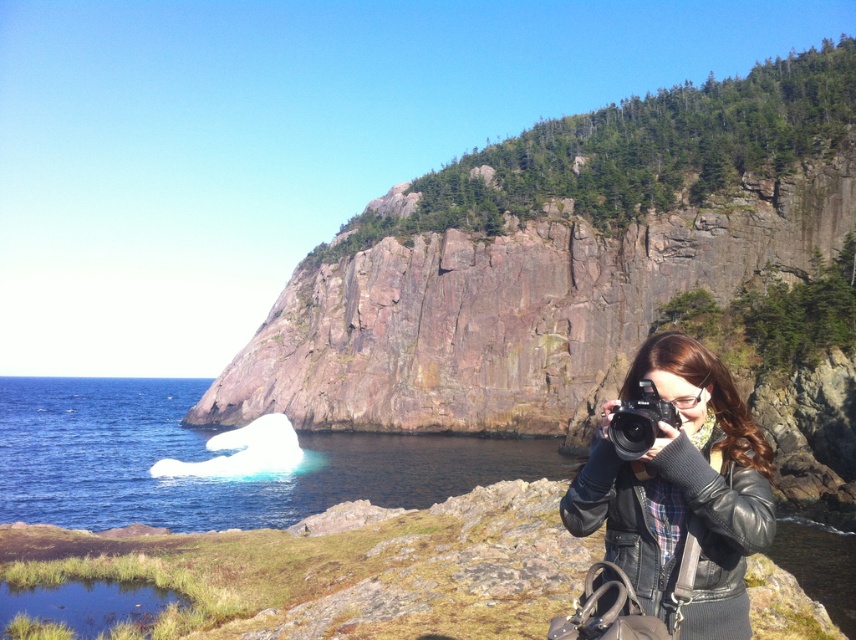
Does brown rock cliff at center appear over black plastic camera at lower right?

Yes.

Identify the location of brown rock cliff at center. This screenshot has height=640, width=856. [551, 257].

Describe the element at coordinates (551, 257) in the screenshot. I see `brown rock cliff at center` at that location.

Where is `brown rock cliff at center`? Image resolution: width=856 pixels, height=640 pixels. brown rock cliff at center is located at coordinates (551, 257).

Who is shorter, white ice at lower left or black leather jacket at lower right?

black leather jacket at lower right

Is white ice at lower left behind black leather jacket at lower right?

Yes, white ice at lower left is behind black leather jacket at lower right.

Describe the element at coordinates (214, 458) in the screenshot. I see `white ice at lower left` at that location.

Identify the location of white ice at lower left. The height and width of the screenshot is (640, 856). (214, 458).

Between brown rock cliff at center and black leather jacket at lower right, which one has less height?

With less height is black leather jacket at lower right.

The image size is (856, 640). Describe the element at coordinates (551, 257) in the screenshot. I see `brown rock cliff at center` at that location.

Who is more distant from viewer, (423, 404) or (745, 547)?

Point (423, 404)

At what (x,y) coordinates should I click in order to perform the action: click on brown rock cliff at center. Please return your answer as a coordinate pair (x, y). Looking at the image, I should click on (551, 257).